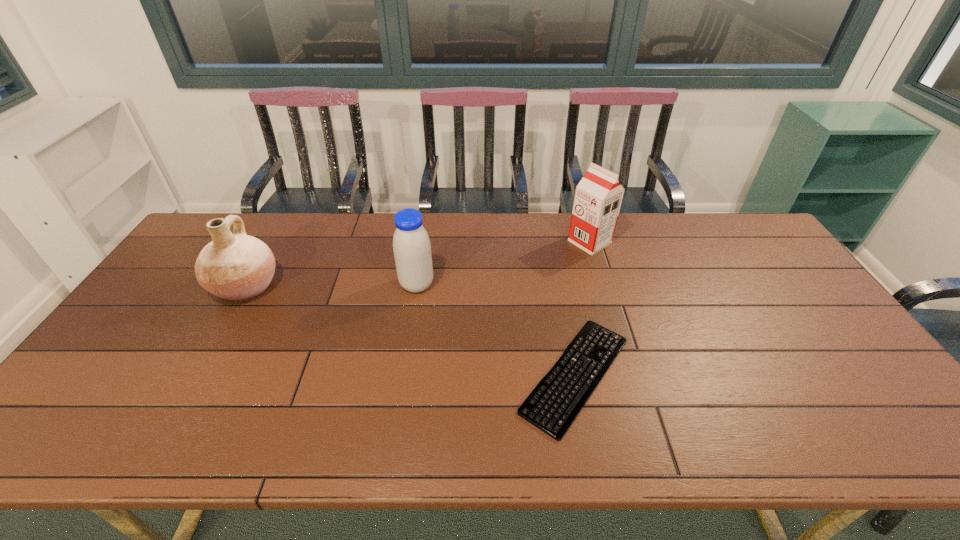
This screenshot has height=540, width=960. In order to click on vacant space that satisfies the following two spatial constraints: 1. to pour from the handle of the leftmost object; 2. on the left side of the computer keyboard in this screenshot , I will do `click(195, 375)`.

Find the location of a particular element. The height and width of the screenshot is (540, 960). blank area in the image that satisfies the following two spatial constraints: 1. to pour from the handle of the leftmost object; 2. on the right side of the computer keyboard is located at coordinates (x=195, y=375).

This screenshot has width=960, height=540. Identify the location of free region that satisfies the following two spatial constraints: 1. on the back side of the computer keyboard; 2. to pour from the handle of the pottery. (559, 286).